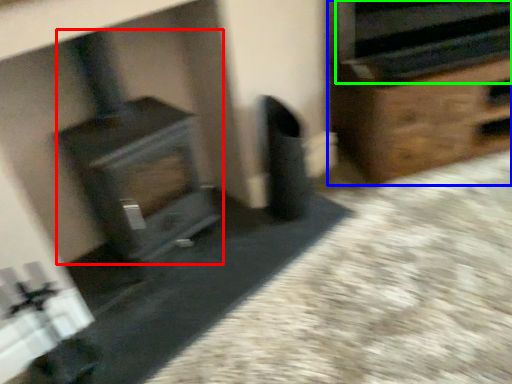
Question: Which object is positioned farthest from wood burning stove (highlighted by a red box)? Select from furniture (highlighted by a blue box) and stereo (highlighted by a green box).

Choices:
 (A) furniture
 (B) stereo

Answer: (B)